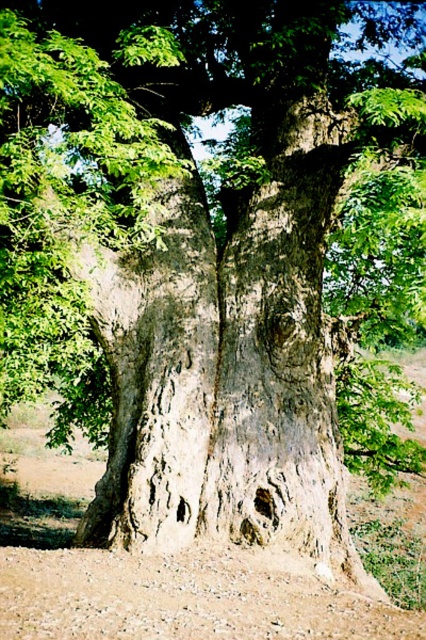
Which is in front, point (344, 596) or point (43, 616)?

Positioned in front is point (43, 616).

What do you see at coordinates (183, 568) in the screenshot? I see `brown sandy soil at center` at bounding box center [183, 568].

The height and width of the screenshot is (640, 426). What do you see at coordinates (183, 568) in the screenshot? I see `brown sandy soil at center` at bounding box center [183, 568].

The height and width of the screenshot is (640, 426). Find the location of `brown sandy soil at center`. brown sandy soil at center is located at coordinates (183, 568).